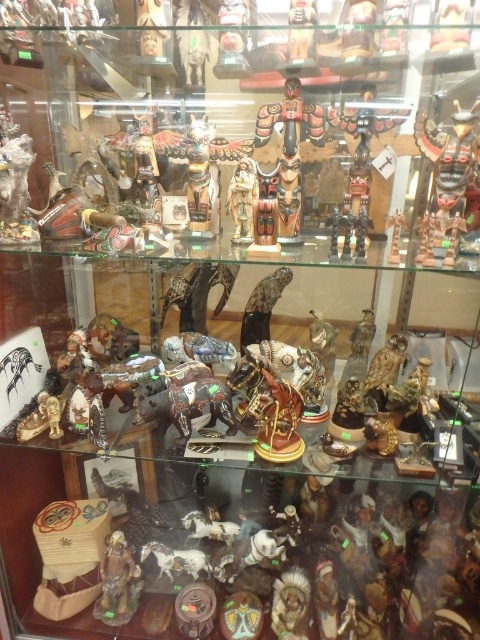
How much distance is there between matte wooden totem pole at upper center and matte gold statue at center?

23.42 centimeters

Is matte wooden totem pole at upper center positioned behind matte gold statue at center?

No, matte wooden totem pole at upper center is closer to the viewer.

Is point (225, 44) farther from viewer compared to point (241, 180)?

No, (225, 44) is closer to viewer.

This screenshot has height=640, width=480. I want to click on matte wooden totem pole at upper center, so click(x=232, y=40).

Consider the image. Who is more distant from viewer, (107, 557) or (292, 579)?

Point (107, 557)

Is point (127, 614) less distant than point (291, 621)?

No, (127, 614) is further to viewer.

Based on the photo, measure the distance between matte brown totem pole at lower left and camera.

3.72 feet

Find the location of a particular element. The image size is (480, 640). matte brown totem pole at lower left is located at coordinates (118, 582).

Is matte brown figurine at lower center positioned before wooden totem pole at center?

No, it is not.

Which is above, matte brown figurine at lower center or wooden totem pole at center?

wooden totem pole at center

Does point (309, 589) come behind point (299, 16)?

Yes, it is behind point (299, 16).

The width and height of the screenshot is (480, 640). What are the coordinates of `matte brown figurine at lower center` in the screenshot? It's located at (290, 604).